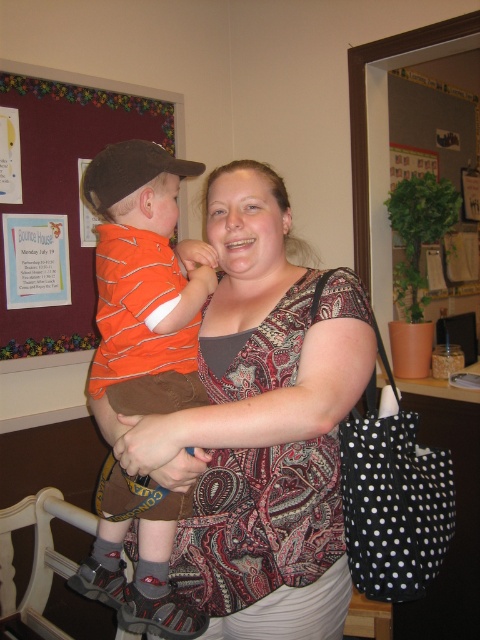
Question: Considering the real-world distances, which object is farthest from the wooden rocking chair at lower left?

Choices:
 (A) matte brown arm at center
 (B) paisley-patterned blouse at center

Answer: (A)

Question: Can you confirm if matte brown arm at center is thinner than wooden rocking chair at lower left?

Choices:
 (A) yes
 (B) no

Answer: (A)

Question: Which of the following is the closest to the observer?

Choices:
 (A) (229, 225)
 (B) (4, 602)
 (C) (2, 250)
 (D) (106, 193)

Answer: (A)

Question: Is orange striped shirt at center bigger than orange striped shirt at upper left?

Choices:
 (A) no
 (B) yes

Answer: (A)

Question: Which of these objects is positioned closest to the paisley-patterned blouse at center?

Choices:
 (A) matte brown arm at center
 (B) orange striped shirt at upper left
 (C) orange striped shirt at center
 (D) wooden rocking chair at lower left

Answer: (A)

Question: Considering the relative positions of paisley-patterned blouse at center and wooden rocking chair at lower left in the image provided, where is paisley-patterned blouse at center located with respect to wooden rocking chair at lower left?

Choices:
 (A) above
 (B) below

Answer: (A)